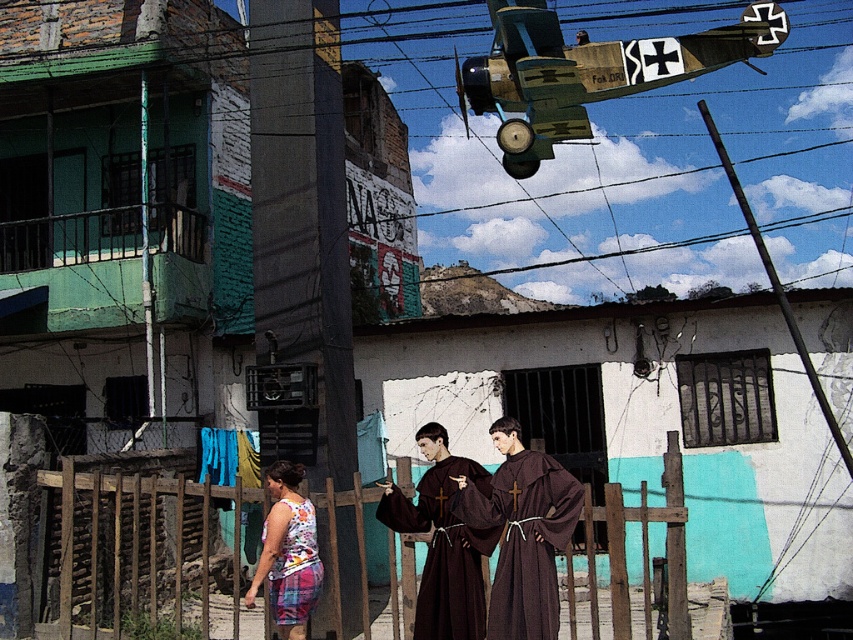
Does brown woolen robe at center have a greater width compared to printed fabric dress at lower center?

Indeed, brown woolen robe at center has a greater width compared to printed fabric dress at lower center.

What are the coordinates of `brown woolen robe at center` in the screenshot? It's located at (445, 550).

This screenshot has width=853, height=640. Find the location of `brown woolen robe at center`. brown woolen robe at center is located at coordinates (445, 550).

Is brown woolen robes at center to the right of printed fabric dress at lower center from the viewer's perspective?

Yes, brown woolen robes at center is to the right of printed fabric dress at lower center.

Does brown woolen robes at center appear under printed fabric dress at lower center?

No, brown woolen robes at center is not below printed fabric dress at lower center.

Is point (544, 627) positioned in front of point (281, 582)?

Yes, point (544, 627) is in front of point (281, 582).

Find the location of a particular element. brown woolen robes at center is located at coordinates (451, 534).

I want to click on camouflage fabric plane at upper right, so click(587, 72).

Does camouflage fabric plane at upper right have a lesser width compared to printed fabric dress at lower center?

Incorrect, camouflage fabric plane at upper right's width is not less than printed fabric dress at lower center's.

Who is more forward, (514, 35) or (276, 582)?

Point (276, 582)

The image size is (853, 640). Identify the location of camouflage fabric plane at upper right. (587, 72).